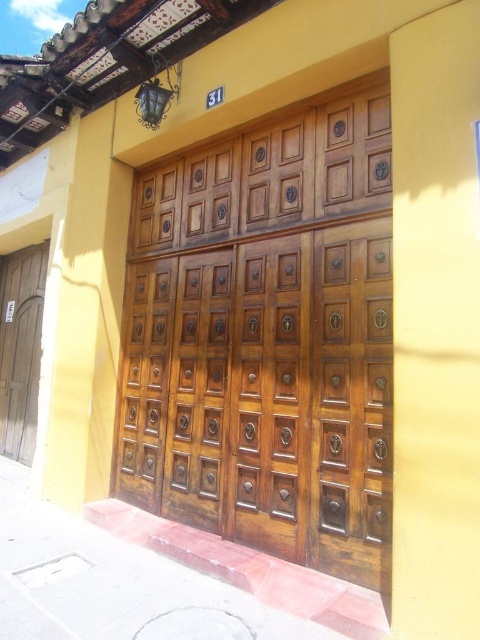
You are standing in front of a building with two doors. You need to enter through the door that is on the right side. Which door should you choose between the polished wood door at center and the wooden door at left?

You should choose the polished wood door at center because it is located to the right of the wooden door at left, making it the door on the right side.

You are a delivery person with a 2.5 meter wide truck. You need to park between the polished wood door at center and the wooden door at left. Can your truck fit in the space between them?

The distance between the polished wood door at center and the wooden door at left is 3.40 meters. Since your truck is 2.5 meters wide, it can fit in the space between them as the available space is wider than the truck.

You are standing in front of a building with a polished wood door at center. To locate the door, where should you look relative to your central vision?

The polished wood door at center is located at point 0.528 on the horizontal axis and 0.556 on the vertical axis, so you should look slightly above and to the right of your central vision to locate it.